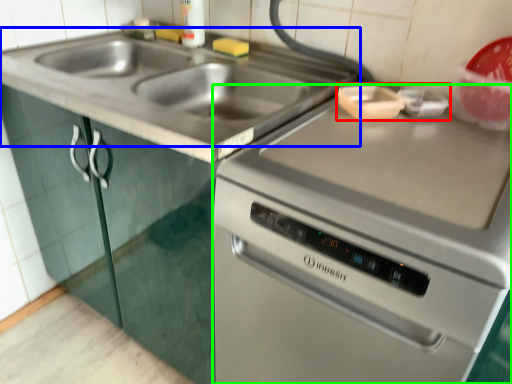
Question: Estimate the real-world distances between objects in this image. Which object is closer to appliance (highlighted by a red box), sink (highlighted by a blue box) or oven (highlighted by a green box)?

Choices:
 (A) sink
 (B) oven

Answer: (B)